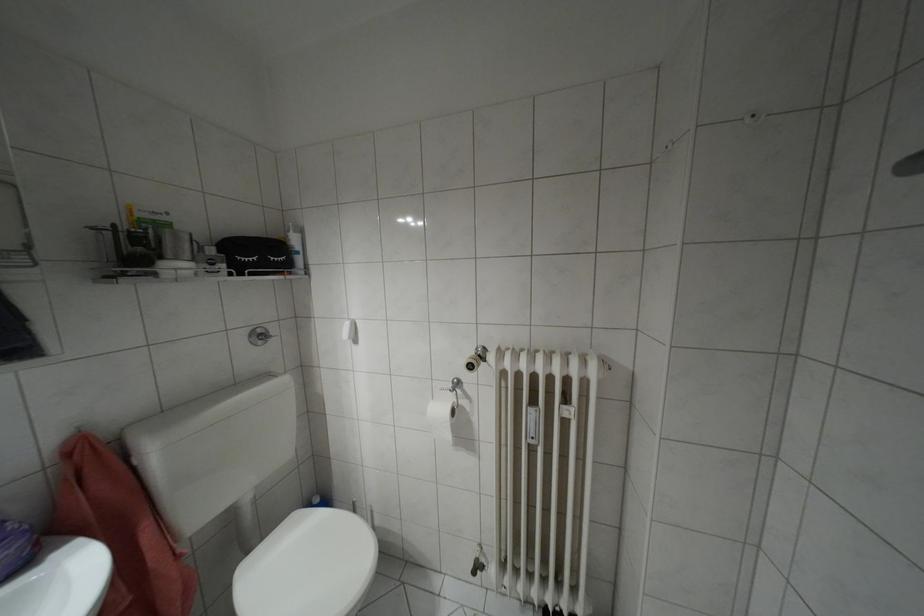
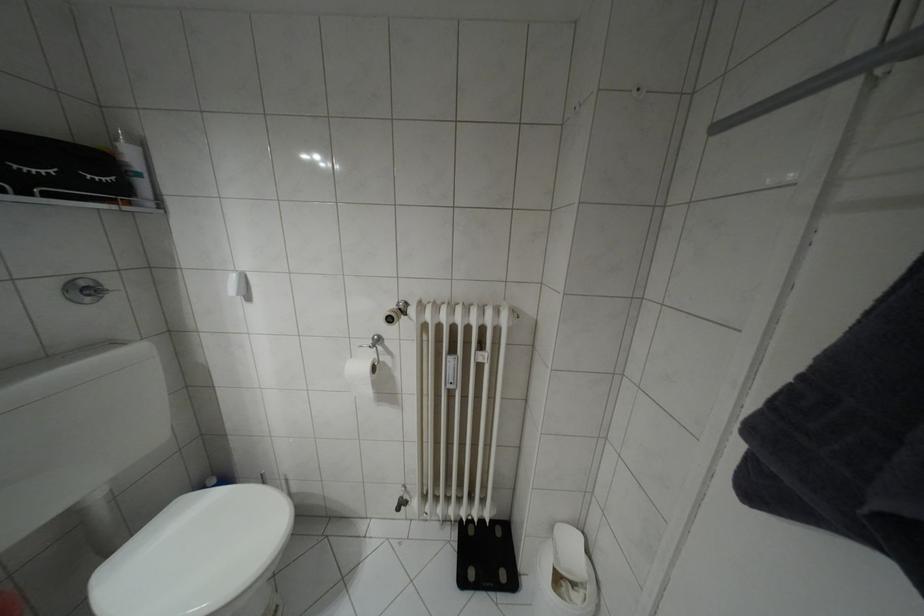
Where in the second image is the point corresponding to (286,230) from the first image?

(116, 139)